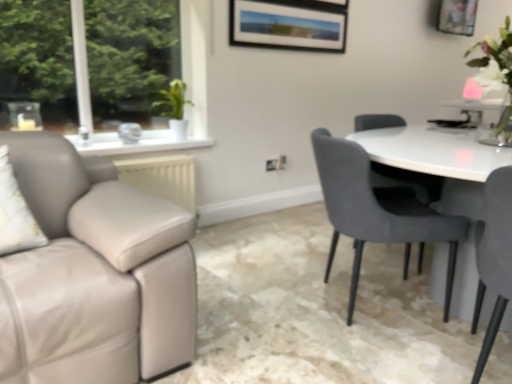
Question: Is white glossy vase at upper right shorter than wooden picture frame at upper right?

Choices:
 (A) yes
 (B) no

Answer: (B)

Question: Is white glossy vase at upper right to the left of wooden picture frame at upper right from the viewer's perspective?

Choices:
 (A) no
 (B) yes

Answer: (B)

Question: Does white glossy vase at upper right have a smaller size compared to wooden picture frame at upper right?

Choices:
 (A) no
 (B) yes

Answer: (A)

Question: Is white glossy vase at upper right turned away from wooden picture frame at upper right?

Choices:
 (A) no
 (B) yes

Answer: (A)

Question: Is wooden picture frame at upper right inside white glossy vase at upper right?

Choices:
 (A) no
 (B) yes

Answer: (A)

Question: Does white glossy vase at upper right turn towards wooden picture frame at upper right?

Choices:
 (A) yes
 (B) no

Answer: (B)

Question: Is the position of velvet grey chair at right, the 1th chair positioned from the back, less distant than that of white glossy vase at upper right?

Choices:
 (A) no
 (B) yes

Answer: (B)

Question: Can you confirm if velvet grey chair at right, which is the 2th chair from front to back, is positioned to the right of white glossy vase at upper right?

Choices:
 (A) yes
 (B) no

Answer: (B)

Question: From a real-world perspective, is velvet grey chair at right, which is the 2th chair from front to back, below white glossy vase at upper right?

Choices:
 (A) yes
 (B) no

Answer: (A)

Question: Does velvet grey chair at right, which is the 2th chair from front to back, have a lesser height compared to white glossy vase at upper right?

Choices:
 (A) yes
 (B) no

Answer: (B)

Question: Considering the relative sizes of velvet grey chair at right, the 1th chair positioned from the back, and white glossy vase at upper right in the image provided, is velvet grey chair at right, the 1th chair positioned from the back, bigger than white glossy vase at upper right?

Choices:
 (A) yes
 (B) no

Answer: (A)

Question: Is velvet grey chair at right, the 1th chair positioned from the back, positioned far away from white glossy vase at upper right?

Choices:
 (A) yes
 (B) no

Answer: (B)

Question: Can we say white glossy vase at upper right lies outside velvet grey chair at right, which is the 2th chair from front to back?

Choices:
 (A) yes
 (B) no

Answer: (A)